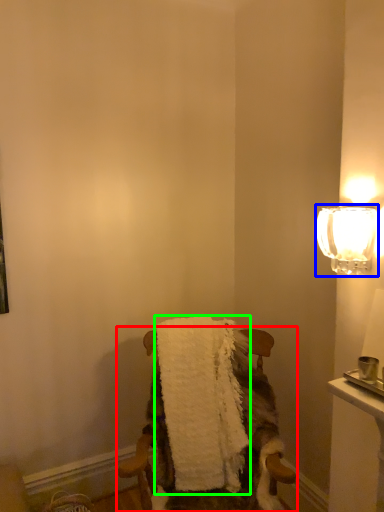
Question: Which object is positioned farthest from chair (highlighted by a red box)? Select from lamp (highlighted by a blue box) and bath towel (highlighted by a green box).

Choices:
 (A) lamp
 (B) bath towel

Answer: (A)